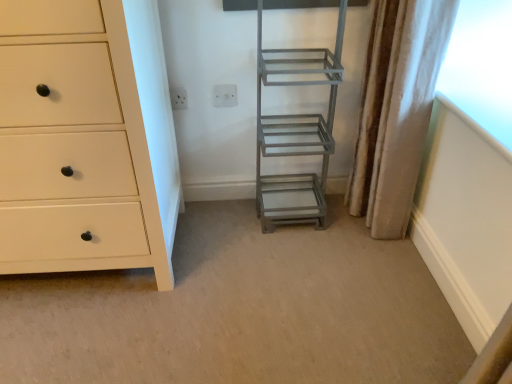
The width and height of the screenshot is (512, 384). I want to click on vacant point to the right of white matte chest of drawers at left, so click(x=250, y=273).